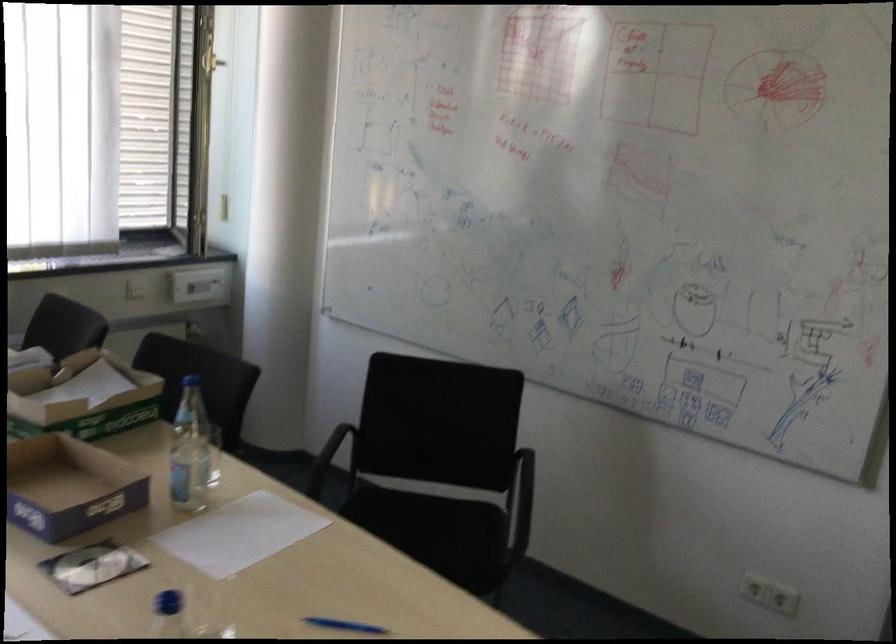
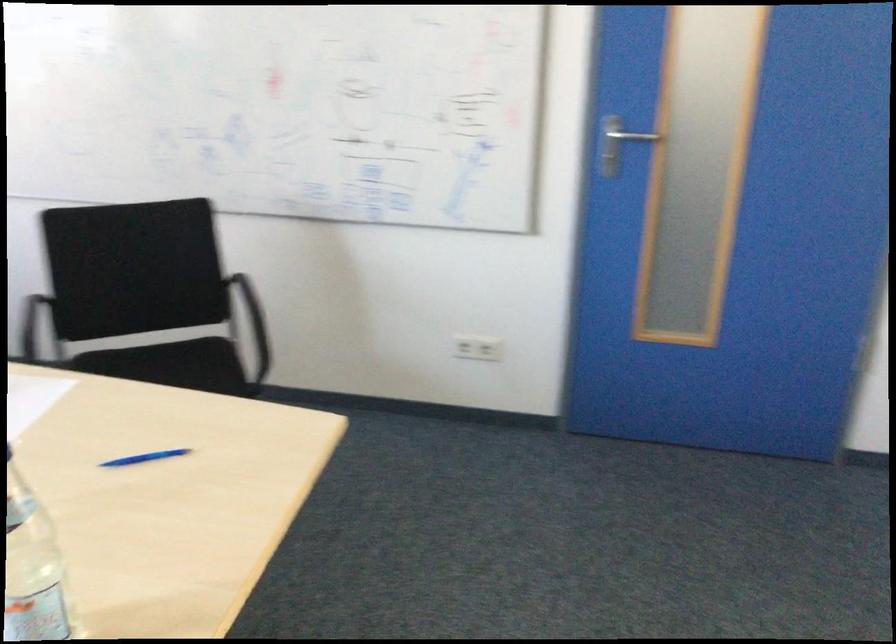
Question: The camera is either moving clockwise (left) or counter-clockwise (right) around the object. The first image is from the beginning of the video and the second image is from the end. Is the camera moving left or right when shooting the video?

Choices:
 (A) Left
 (B) Right

Answer: (A)